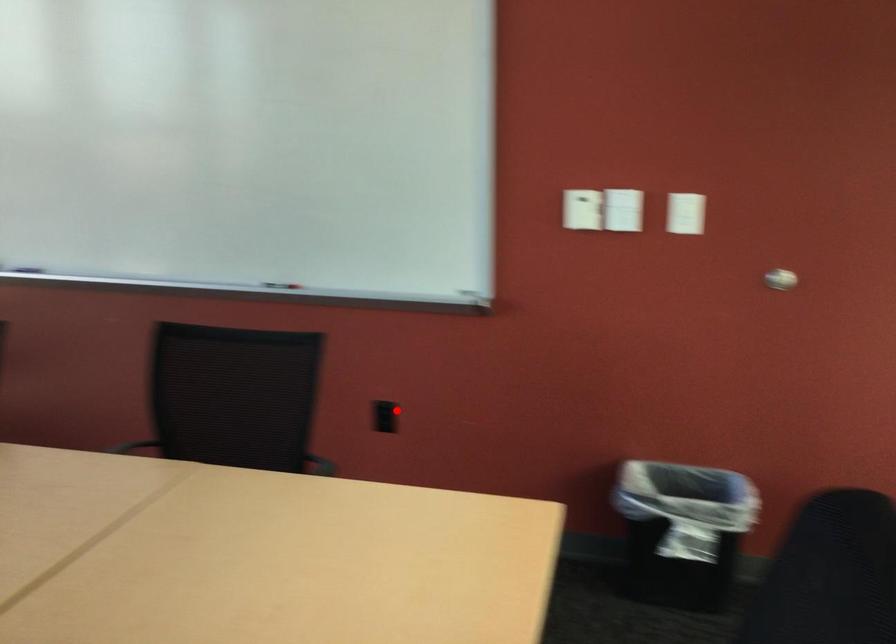
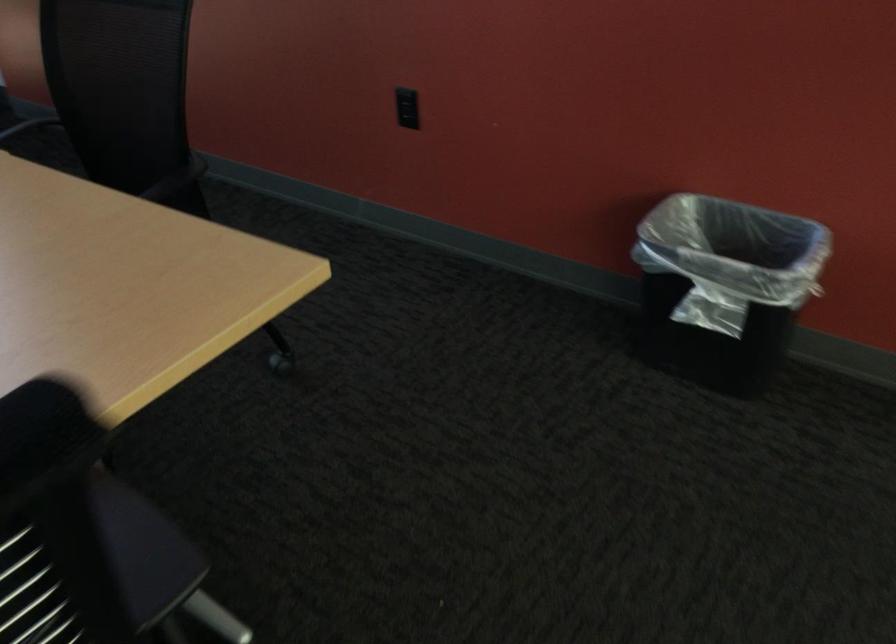
Find the pixel in the second image that matches the highlighted location in the first image.

(407, 102)